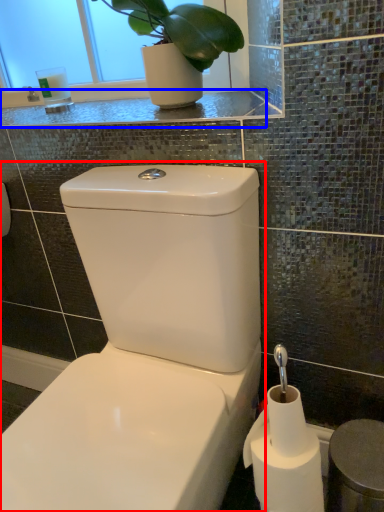
Question: Which object is closer to the camera taking this photo, toilet (highlighted by a red box) or counter top (highlighted by a blue box)?

Choices:
 (A) toilet
 (B) counter top

Answer: (A)